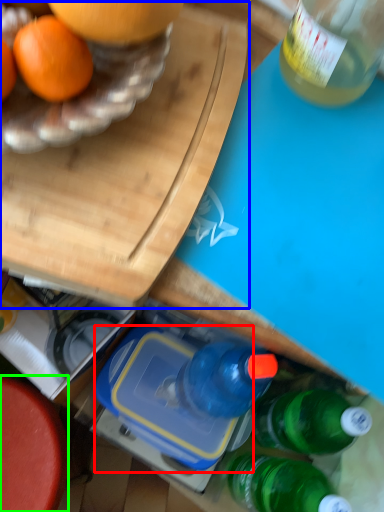
Question: Based on their relative distances, which object is nearer to lunch box (highlighted by a red box)? Choose from cutting board (highlighted by a blue box) and round table (highlighted by a green box).

Choices:
 (A) cutting board
 (B) round table

Answer: (B)